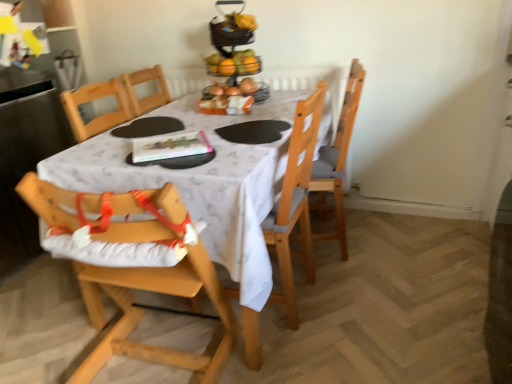
Question: Does point [x=245, y=84] appear closer or farther from the camera than point [x=292, y=110]?

Choices:
 (A) farther
 (B) closer

Answer: (A)

Question: Relative to white fabric table at center, is orange plastic basket at center in front or behind?

Choices:
 (A) behind
 (B) front

Answer: (A)

Question: Estimate the real-world distances between objects in this image. Which object is closer to the wooden chair at center, acting as the second chair starting from the right?

Choices:
 (A) orange plastic basket at center
 (B) shiny metallic fruit basket at upper center
 (C) white fabric table at center
 (D) wooden highchair at lower left, the third chair when ordered from right to left
 (E) wooden chair at right, marked as the 3th chair in a left-to-right arrangement

Answer: (C)

Question: Based on their relative distances, which object is farther from the white fabric table at center?

Choices:
 (A) wooden highchair at lower left, the third chair when ordered from right to left
 (B) wooden chair at right, which appears as the 1th chair when viewed from the right
 (C) orange plastic basket at center
 (D) shiny metallic fruit basket at upper center
 (E) wooden chair at center, acting as the second chair starting from the right

Answer: (D)